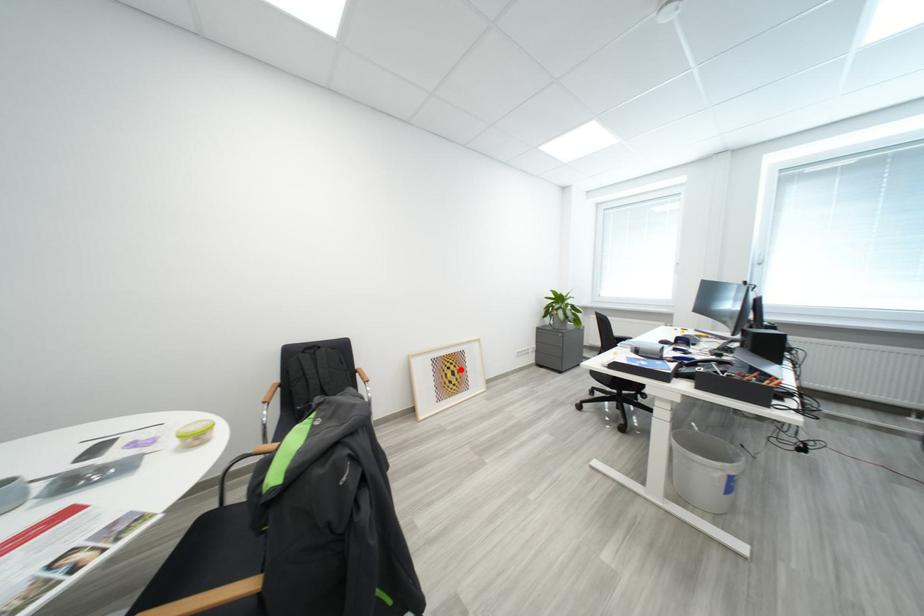
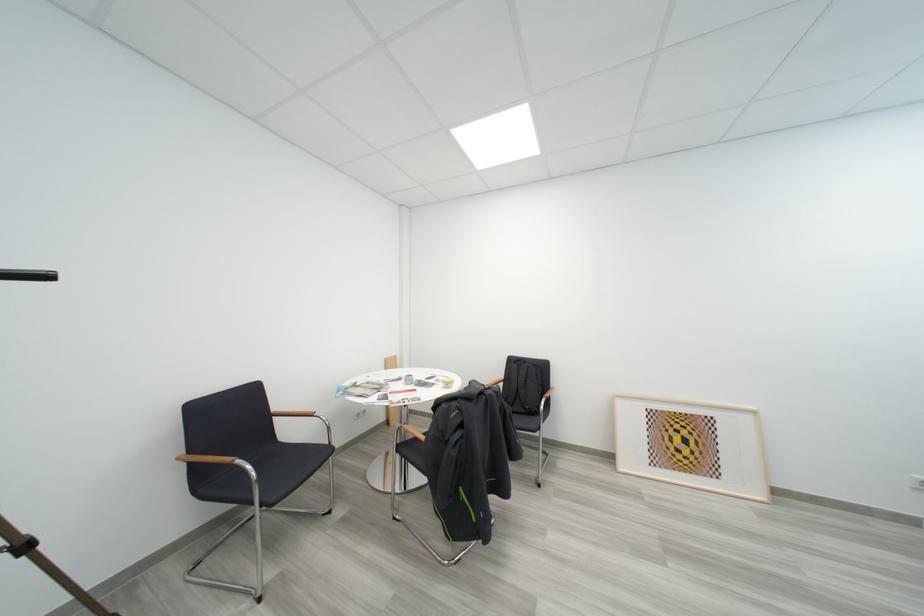
The point at the highlighted location is marked in the first image. Where is the corresponding point in the second image?

(693, 435)